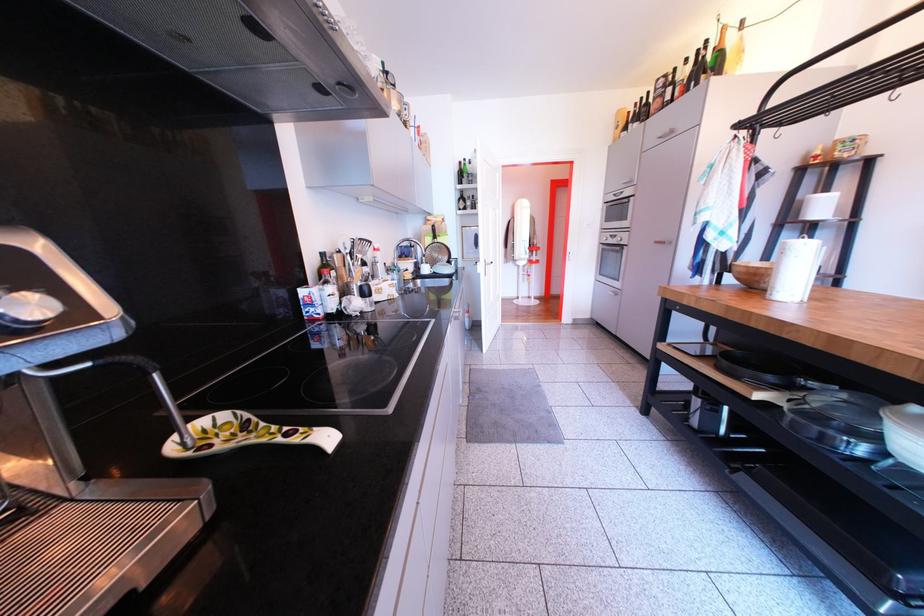
The image size is (924, 616). Find the location of `grey cabinet handle`. grey cabinet handle is located at coordinates (663, 240).